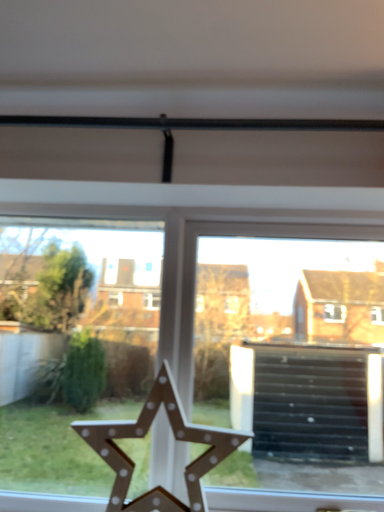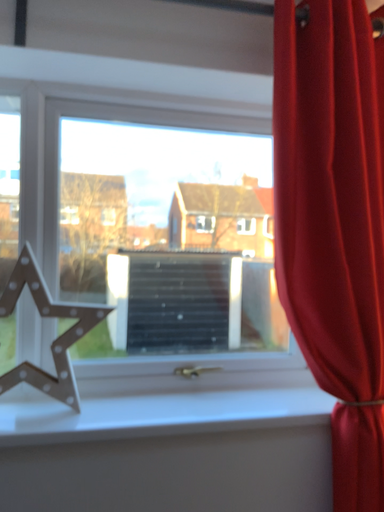
Question: Which way did the camera rotate in the video?

Choices:
 (A) rotated left
 (B) rotated right

Answer: (B)